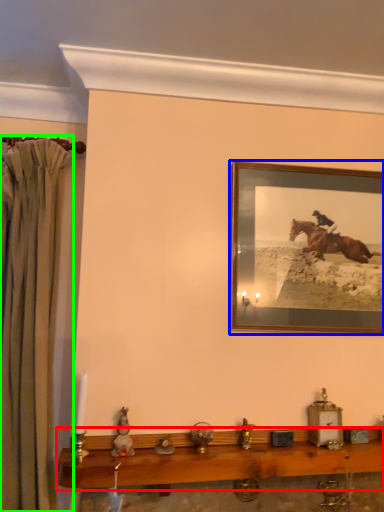
Question: Considering the real-world distances, which object is farthest from table (highlighted by a red box)? picture frame (highlighted by a blue box) or curtain (highlighted by a green box)?

Choices:
 (A) picture frame
 (B) curtain

Answer: (A)